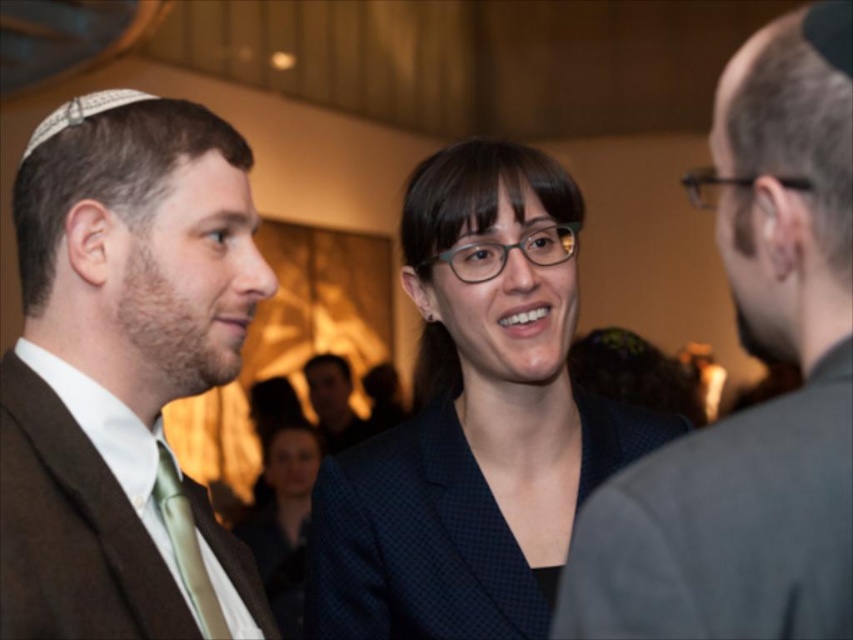
Which of these two, dark gray suit at center or green silk tie at left, stands taller?

dark gray suit at center is taller.

Is dark gray suit at center smaller than green silk tie at left?

No.

This screenshot has width=853, height=640. What do you see at coordinates (757, 404) in the screenshot?
I see `dark gray suit at center` at bounding box center [757, 404].

In order to click on dark gray suit at center in this screenshot , I will do `click(757, 404)`.

Is brown wool suit at left thinner than green silk tie at left?

No.

Based on the photo, which of these two, brown wool suit at left or green silk tie at left, stands shorter?

green silk tie at left is shorter.

Is point (236, 636) farther from viewer compared to point (160, 493)?

Yes.

Find the location of a particular element. brown wool suit at left is located at coordinates (123, 371).

Does brown wool suit at left appear on the right side of dark brown suit at center?

Correct, you'll find brown wool suit at left to the right of dark brown suit at center.

Can you confirm if brown wool suit at left is smaller than dark brown suit at center?

Yes.

Where is `brown wool suit at left`? Image resolution: width=853 pixels, height=640 pixels. brown wool suit at left is located at coordinates click(123, 371).

You are a GUI agent. You are given a task and a screenshot of the screen. Output one action in this format:
    pyautogui.click(x=<x>, y=<y>)
    Task: Click on the brown wool suit at left
    This screenshot has height=640, width=853.
    Given the screenshot: What is the action you would take?
    pyautogui.click(x=123, y=371)